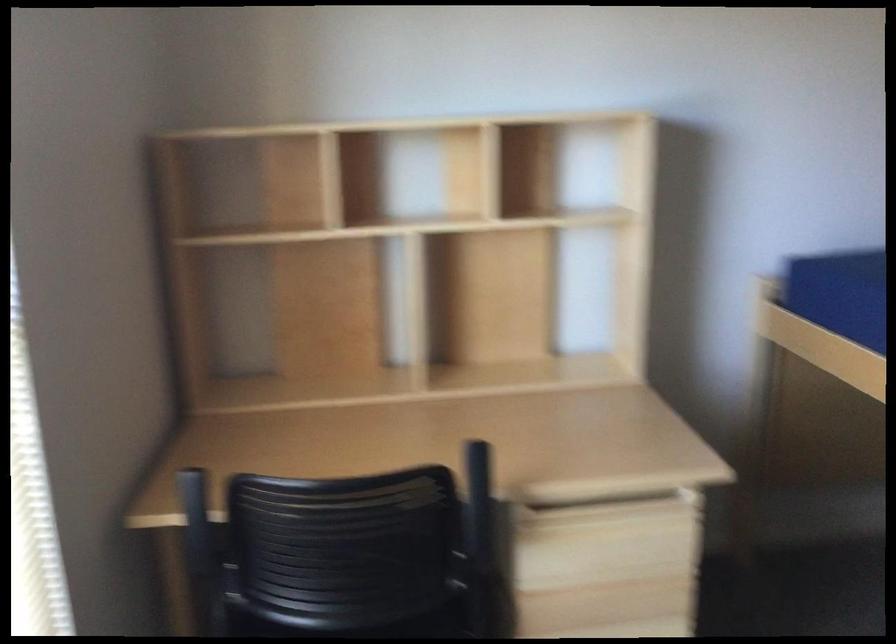
Where would you sit the chair sitting surface? Please return your answer as a coordinate pair (x, y).

(332, 626)